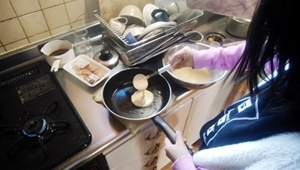
At what (x,y) coordinates should I click in order to perform the action: click on metal part of ladle handle. Please return your answer as a coordinate pair (x, y). The image size is (300, 170). Looking at the image, I should click on (153, 73).